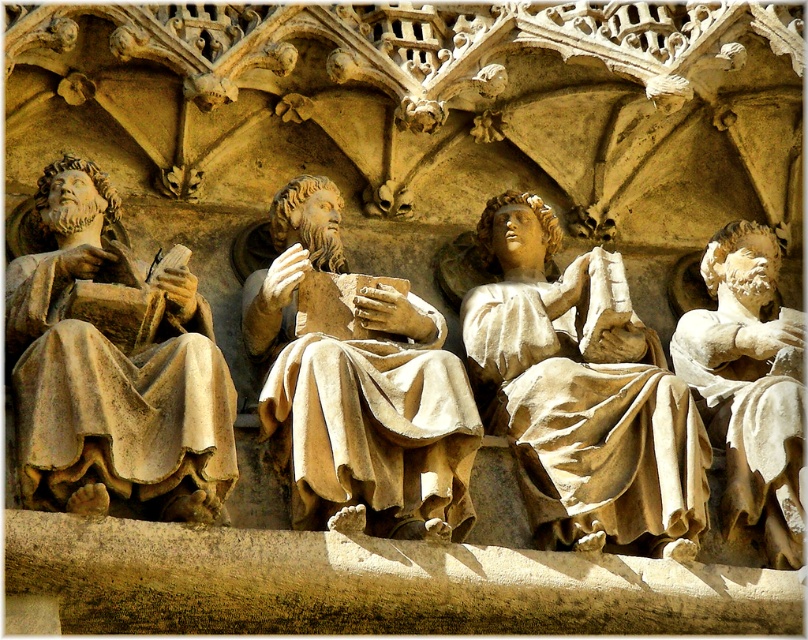
Which is more to the right, matte stone statue at center or beige stone statue at right?

beige stone statue at right is more to the right.

Where is `matte stone statue at center`? This screenshot has height=640, width=808. matte stone statue at center is located at coordinates (583, 392).

What are the coordinates of `matte stone statue at center` in the screenshot? It's located at (583, 392).

Identify the location of matte stone statue at center. (583, 392).

Is point (594, 488) farther from viewer compared to point (394, 332)?

No.

At what (x,y) coordinates should I click in order to perform the action: click on matte stone statue at center. Please return your answer as a coordinate pair (x, y). This screenshot has width=808, height=640. Looking at the image, I should click on (583, 392).

Does beige stone statue at left appear under matte stone statue at center?

Actually, beige stone statue at left is above matte stone statue at center.

Can you confirm if beige stone statue at left is shorter than matte stone statue at center?

Correct, beige stone statue at left is not as tall as matte stone statue at center.

Identify the location of beige stone statue at left. Image resolution: width=808 pixels, height=640 pixels. (112, 364).